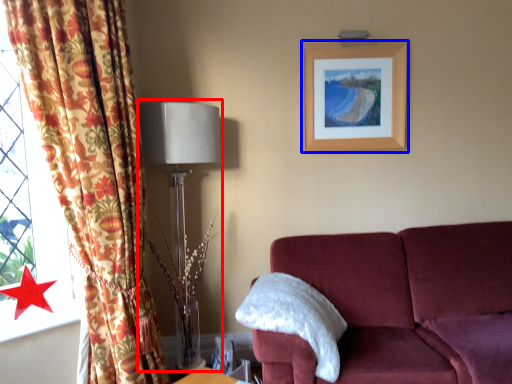
Question: Which object appears closest to the camera in this image, table lamp (highlighted by a red box) or picture frame (highlighted by a blue box)?

Choices:
 (A) table lamp
 (B) picture frame

Answer: (A)